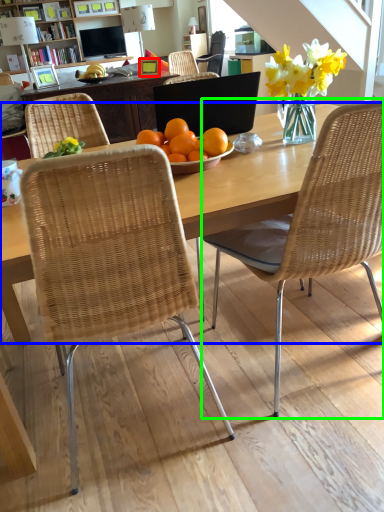
Question: Which object is positioned farthest from picture frame (highlighted by a red box)? Select from desk (highlighted by a blue box) and chair (highlighted by a green box).

Choices:
 (A) desk
 (B) chair

Answer: (B)